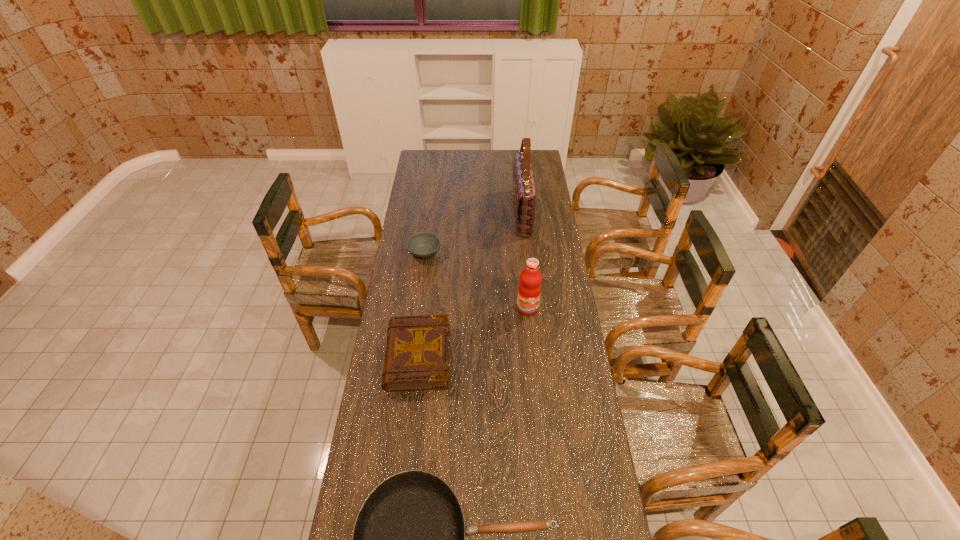
You are a GUI agent. You are given a task and a screenshot of the screen. Output one action in this format:
    pyautogui.click(x=<x>, y=<y>)
    Task: Click on the free point that satisfies the following two spatial constraints: 1. on the front of the tallest object with the clasp; 2. on the front side of the second farthest object
    
    Given the screenshot: What is the action you would take?
    pyautogui.click(x=526, y=252)